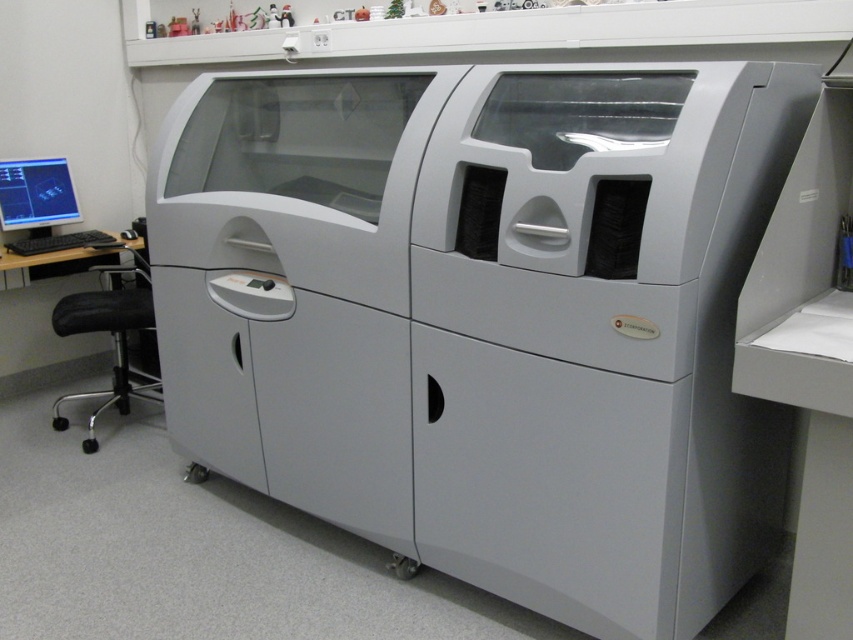
You are an engineer in a lab and need to determine if the matte gray printer at center can fit through a doorway that is exactly the same height as the matte black monitor at left. Based on the scene, will the printer fit through the doorway?

The matte gray printer at center is taller than the matte black monitor at left. Since the doorway is the same height as the matte black monitor, the printer will not fit through the doorway because it is taller than the monitor and thus exceeds the doorway height.

You are setting up a workstation in the lab and need to position your equipment. You have a black plastic computer desk at lower left and a matte black monitor at left. According to the scene, which object is positioned more to the left side of the lab?

The matte black monitor at left is positioned more to the left side of the lab because the black plastic computer desk at lower left is to the right of it.